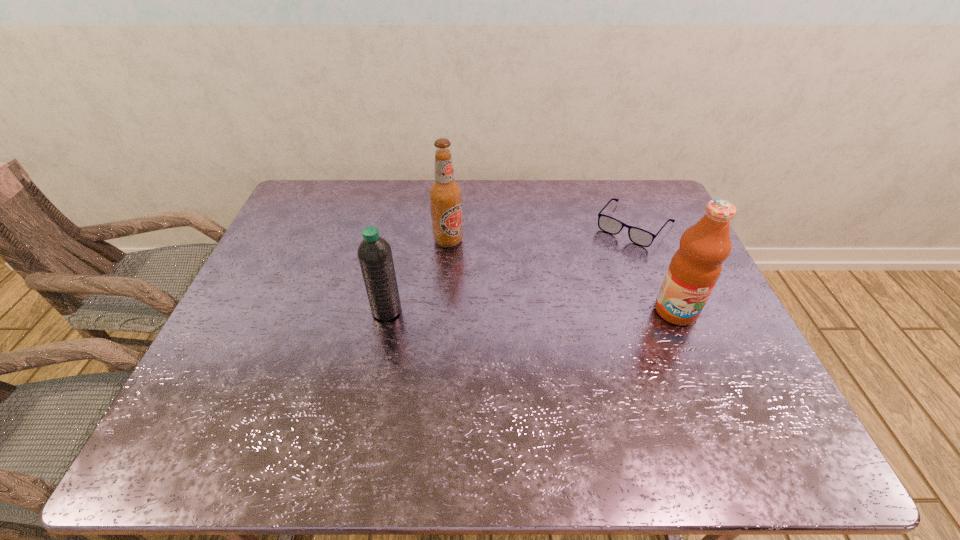
Locate an element on the screen. free space on the desktop that is between the third tallest object and the fruit juice and is positioned on the front-facing side of the shortest object is located at coordinates (567, 311).

The image size is (960, 540). Identify the location of free spot on the desktop that is between the second shortest object and the fruit juice and is positioned on the front label of the beer bottle. (506, 310).